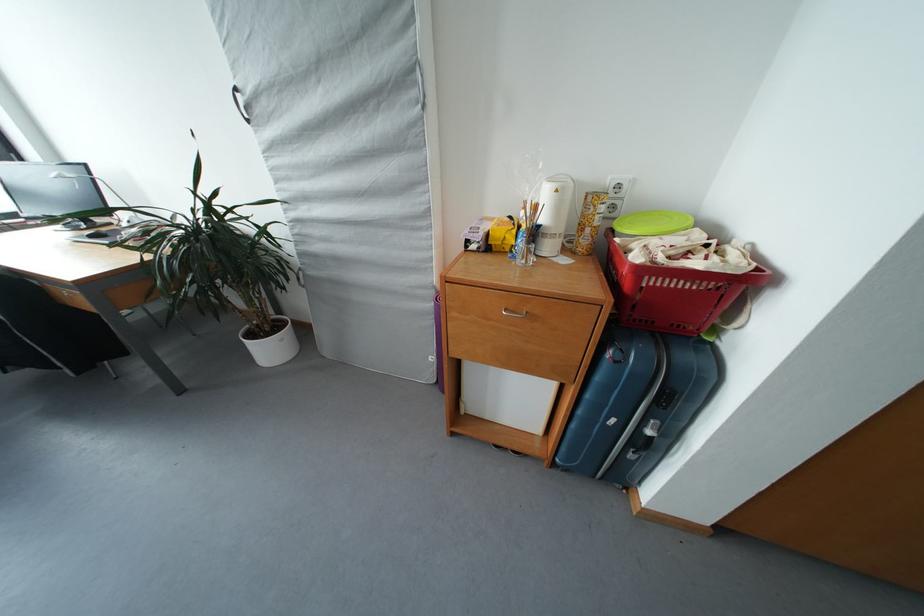
The location [95,233] corresponds to which object?

It refers to a computer mouse.